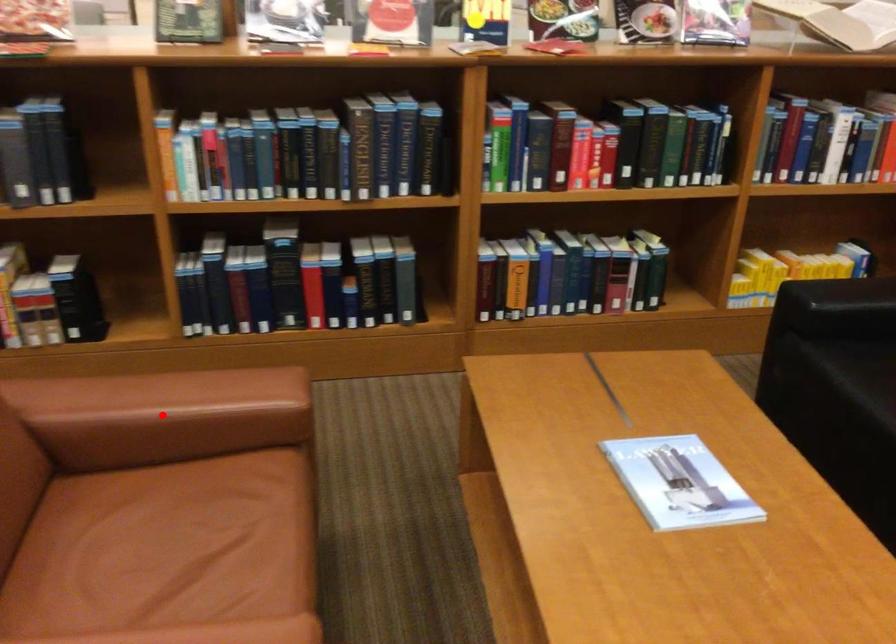
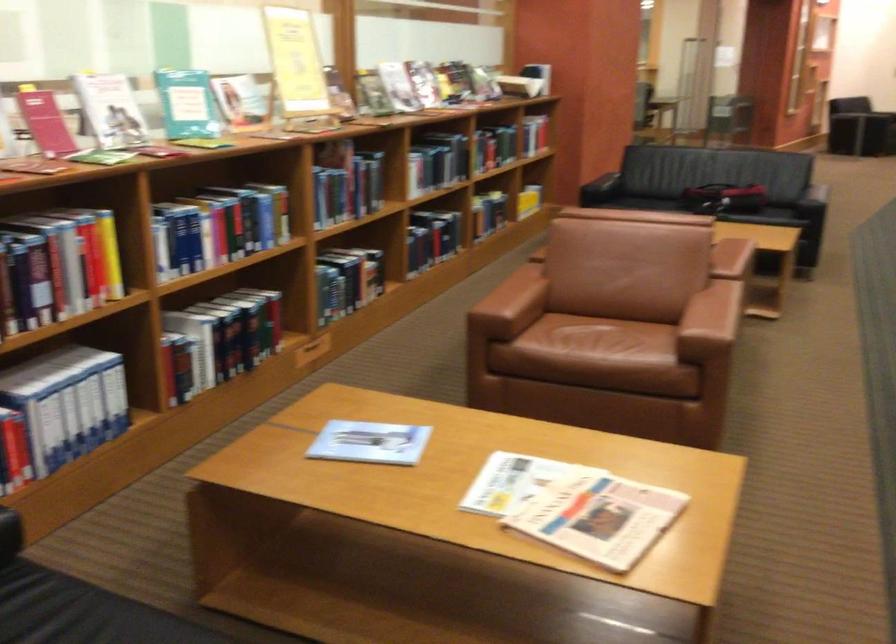
Question: I am providing you with two images of the same scene from different viewpoints. A red point is marked on the first image. Is the red point's position out of view in image 2?

Choices:
 (A) Yes
 (B) No

Answer: (A)